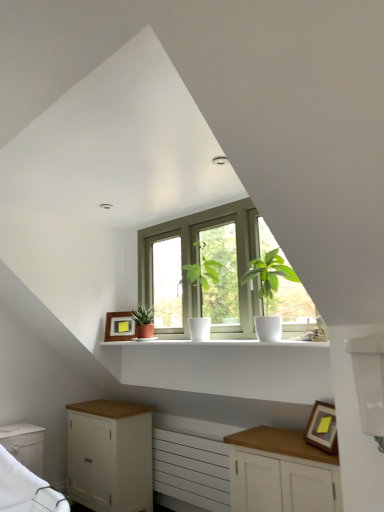
Describe the element at coordinates (218, 342) in the screenshot. I see `white glossy shelf at center` at that location.

The width and height of the screenshot is (384, 512). Describe the element at coordinates (189, 468) in the screenshot. I see `white matte radiator at lower center` at that location.

Where is `green matte plant at center, marked as the first houseplant in a left-to-right arrangement`? The width and height of the screenshot is (384, 512). green matte plant at center, marked as the first houseplant in a left-to-right arrangement is located at coordinates (143, 321).

What are the coordinates of `green matte window at center` in the screenshot? It's located at (221, 272).

Measure the distance between green leafy plant in white pot at center, which is counted as the first houseplant, starting from the front, and camera.

The distance of green leafy plant in white pot at center, which is counted as the first houseplant, starting from the front, from camera is 7.19 feet.

Describe the element at coordinates (110, 455) in the screenshot. I see `white wood cabinet at lower left, the first cabinetry when ordered from back to front` at that location.

You are a GUI agent. You are given a task and a screenshot of the screen. Output one action in this format:
    pyautogui.click(x=<x>, y=<y>)
    Task: Click on the white glossy shelf at center
    
    Given the screenshot: What is the action you would take?
    pyautogui.click(x=218, y=342)

Is green matte plant at center, marked as the 2th houseplant in a right-to-left arrangement, smaller than white wood cabinet at lower left, the first cabinetry when ordered from back to front?

Yes.

Which object is wider, green matte plant at center, marked as the 2th houseplant in a right-to-left arrangement, or white wood cabinet at lower left, the 2th cabinetry from the left?

With larger width is white wood cabinet at lower left, the 2th cabinetry from the left.

Could you tell me if green matte plant at center, marked as the 2th houseplant in a right-to-left arrangement, is turned towards white wood cabinet at lower left, the 2th cabinetry from the left?

No, green matte plant at center, marked as the 2th houseplant in a right-to-left arrangement, is not turned towards white wood cabinet at lower left, the 2th cabinetry from the left.

Which is more to the left, green matte plant at center, which is the first houseplant in back-to-front order, or white wood cabinet at lower left, the 2th cabinetry from the left?

Positioned to the left is white wood cabinet at lower left, the 2th cabinetry from the left.

Find the location of a particular element. radiator below the white matte cabinet at lower left, which is the 1th cabinetry in left-to-right order (from the image's perspective) is located at coordinates (189, 468).

Between white matte radiator at lower center and white matte cabinet at lower left, which is the second cabinetry from front to back, which one appears on the left side from the viewer's perspective?

From the viewer's perspective, white matte cabinet at lower left, which is the second cabinetry from front to back, appears more on the left side.

Would you say white matte radiator at lower center is outside white matte cabinet at lower left, which is the second cabinetry from front to back?

Indeed, white matte radiator at lower center is completely outside white matte cabinet at lower left, which is the second cabinetry from front to back.

Is green leafy plant in white pot at center, marked as the second houseplant in a back-to-front arrangement, facing towards white wood cabinet at lower center, the first cabinetry positioned from the front?

No, green leafy plant in white pot at center, marked as the second houseplant in a back-to-front arrangement, does not turn towards white wood cabinet at lower center, the first cabinetry positioned from the front.

From the image's perspective, is green leafy plant in white pot at center, the second houseplant in the left-to-right sequence, on white wood cabinet at lower center, the 3th cabinetry viewed from the left?

Correct, green leafy plant in white pot at center, the second houseplant in the left-to-right sequence, appears higher than white wood cabinet at lower center, the 3th cabinetry viewed from the left, in the image.

Considering the positions of objects green leafy plant in white pot at center, the second houseplant in the left-to-right sequence, and white wood cabinet at lower center, arranged as the 1th cabinetry when viewed from the right, in the image provided, who is behind, green leafy plant in white pot at center, the second houseplant in the left-to-right sequence, or white wood cabinet at lower center, arranged as the 1th cabinetry when viewed from the right,?

green leafy plant in white pot at center, the second houseplant in the left-to-right sequence, is further away from the camera.

I want to click on cabinetry lying in front of the white glossy shelf at center, so click(281, 472).

Is white wood cabinet at lower center, the 3th cabinetry viewed from the left, not inside white glossy shelf at center?

white wood cabinet at lower center, the 3th cabinetry viewed from the left, lies outside white glossy shelf at center's area.

Is point (284, 471) positioned behind point (313, 344)?

No, it is not.

From a real-world perspective, which object rests below the other?

In real-world perspective, white wood cabinet at lower center, arranged as the 1th cabinetry when viewed from the right, is lower.

Considering the relative sizes of green leafy plant in white pot at center, marked as the second houseplant in a back-to-front arrangement, and green matte window at center in the image provided, is green leafy plant in white pot at center, marked as the second houseplant in a back-to-front arrangement, smaller than green matte window at center?

Indeed, green leafy plant in white pot at center, marked as the second houseplant in a back-to-front arrangement, has a smaller size compared to green matte window at center.

Is green leafy plant in white pot at center, marked as the second houseplant in a back-to-front arrangement, positioned with its back to green matte window at center?

That's right, green leafy plant in white pot at center, marked as the second houseplant in a back-to-front arrangement, is facing away from green matte window at center.

From the picture: Can you confirm if green leafy plant in white pot at center, the first houseplant when ordered from right to left, is wider than green matte window at center?

Yes, green leafy plant in white pot at center, the first houseplant when ordered from right to left, is wider than green matte window at center.

Is point (290, 267) closer or farther from the camera than point (226, 250)?

Point (290, 267).

Can we say white matte cabinet at lower left, which is counted as the 2th cabinetry, starting from the back, lies outside white fabric bed frame at lower left?

Yes, white matte cabinet at lower left, which is counted as the 2th cabinetry, starting from the back, is located beyond the bounds of white fabric bed frame at lower left.

From a real-world perspective, does white matte cabinet at lower left, which is the 1th cabinetry in left-to-right order, sit lower than white fabric bed frame at lower left?

Correct, in the physical world, white matte cabinet at lower left, which is the 1th cabinetry in left-to-right order, is lower than white fabric bed frame at lower left.

Could you tell me if white matte cabinet at lower left, which is counted as the 2th cabinetry, starting from the back, is turned towards white fabric bed frame at lower left?

Yes.

Is white matte cabinet at lower left, which is the 1th cabinetry in left-to-right order, to the right of white fabric bed frame at lower left from the viewer's perspective?

No.

From the image's perspective, which object appears higher, matte wooden picture frame at center, placed as the first picture frame when sorted from left to right, or white wood cabinet at lower center, the third cabinetry from the back?

matte wooden picture frame at center, placed as the first picture frame when sorted from left to right, appears higher in the image.

Consider the image. From a real-world perspective, which is physically above, matte wooden picture frame at center, positioned as the first picture frame in back-to-front order, or white wood cabinet at lower center, the third cabinetry from the back?

matte wooden picture frame at center, positioned as the first picture frame in back-to-front order.

Which picture frame is the 2nd one when counting from the back of the white wood cabinet at lower center, the first cabinetry positioned from the front? Please provide its 2D coordinates.

[(119, 326)]

Between matte wooden picture frame at center, placed as the first picture frame when sorted from left to right, and white wood cabinet at lower center, the third cabinetry from the back, which one has larger size?

Bigger between the two is white wood cabinet at lower center, the third cabinetry from the back.

There is a white wood cabinet at lower left, the third cabinetry positioned from the front. Where is `the 1st houseplant above it (from a real-world perspective)`? The width and height of the screenshot is (384, 512). the 1st houseplant above it (from a real-world perspective) is located at coordinates (143, 321).

Identify the location of radiator located underneath the white matte cabinet at lower left, which is counted as the 2th cabinetry, starting from the back (from a real-world perspective). The image size is (384, 512). (189, 468).

Based on their spatial positions, is green leafy plant in white pot at center, marked as the second houseplant in a back-to-front arrangement, or white matte radiator at lower center further from wooden framed picture at lower right, which ranks as the 1th picture frame in right-to-left order?

white matte radiator at lower center is positioned further to the anchor wooden framed picture at lower right, which ranks as the 1th picture frame in right-to-left order.

Estimate the real-world distances between objects in this image. Which object is closer to white wood cabinet at lower left, which appears as the second cabinetry when viewed from the right, green leafy plant in white pot at center, the first houseplant when ordered from right to left, or white matte cabinet at lower left, which is the 1th cabinetry in left-to-right order?

The object closer to white wood cabinet at lower left, which appears as the second cabinetry when viewed from the right, is white matte cabinet at lower left, which is the 1th cabinetry in left-to-right order.

Looking at the image, which one is located closer to wooden framed picture at lower right, which ranks as the 1th picture frame in right-to-left order, matte wooden picture frame at center, the 2th picture frame in the front-to-back sequence, or white fabric bed frame at lower left?

Among the two, white fabric bed frame at lower left is located nearer to wooden framed picture at lower right, which ranks as the 1th picture frame in right-to-left order.

Looking at the image, which one is located closer to green leafy plant in white pot at center, the second houseplant in the left-to-right sequence, green matte window at center or wooden framed picture at lower right, which is counted as the second picture frame, starting from the top?

Based on the image, green matte window at center appears to be nearer to green leafy plant in white pot at center, the second houseplant in the left-to-right sequence.

When comparing their distances from green matte window at center, does white matte radiator at lower center or green matte plant at center, which is the first houseplant in back-to-front order, seem closer?

The object closer to green matte window at center is green matte plant at center, which is the first houseplant in back-to-front order.

Looking at the image, which one is located further to white matte radiator at lower center, white wood cabinet at lower left, the first cabinetry when ordered from back to front, or white glossy shelf at center?

white glossy shelf at center is further to white matte radiator at lower center.

Which object lies nearer to the anchor point matte wooden picture frame at center, the 2th picture frame in the front-to-back sequence, white fabric bed frame at lower left or white matte cabinet at lower left, which is the second cabinetry from front to back?

The object closer to matte wooden picture frame at center, the 2th picture frame in the front-to-back sequence, is white matte cabinet at lower left, which is the second cabinetry from front to back.

In the scene shown: Considering their positions, is matte wooden picture frame at center, positioned as the first picture frame in back-to-front order, positioned closer to green leafy plant in white pot at center, which is counted as the first houseplant, starting from the front, than white wood cabinet at lower center, the 3th cabinetry viewed from the left?

Among the two, white wood cabinet at lower center, the 3th cabinetry viewed from the left, is located nearer to green leafy plant in white pot at center, which is counted as the first houseplant, starting from the front.

Image resolution: width=384 pixels, height=512 pixels. I want to click on picture frame located between white wood cabinet at lower center, arranged as the 1th cabinetry when viewed from the right, and white matte radiator at lower center in the depth direction, so click(x=322, y=428).

You are a GUI agent. You are given a task and a screenshot of the screen. Output one action in this format:
    pyautogui.click(x=<x>, y=<y>)
    Task: Click on the picture frame positioned between white wood cabinet at lower center, the first cabinetry positioned from the front, and green matte plant at center, marked as the 2th houseplant in a right-to-left arrangement, from near to far
    The height and width of the screenshot is (512, 384).
    Given the screenshot: What is the action you would take?
    pyautogui.click(x=322, y=428)

Find the location of a particular element. The width and height of the screenshot is (384, 512). shelf between white wood cabinet at lower center, the 3th cabinetry viewed from the left, and green matte plant at center, marked as the 2th houseplant in a right-to-left arrangement, in the front-back direction is located at coordinates (218, 342).

Locate an element on the screen. cabinetry between white fabric bed frame at lower left and white wood cabinet at lower left, the first cabinetry when ordered from back to front, along the z-axis is located at coordinates (25, 445).